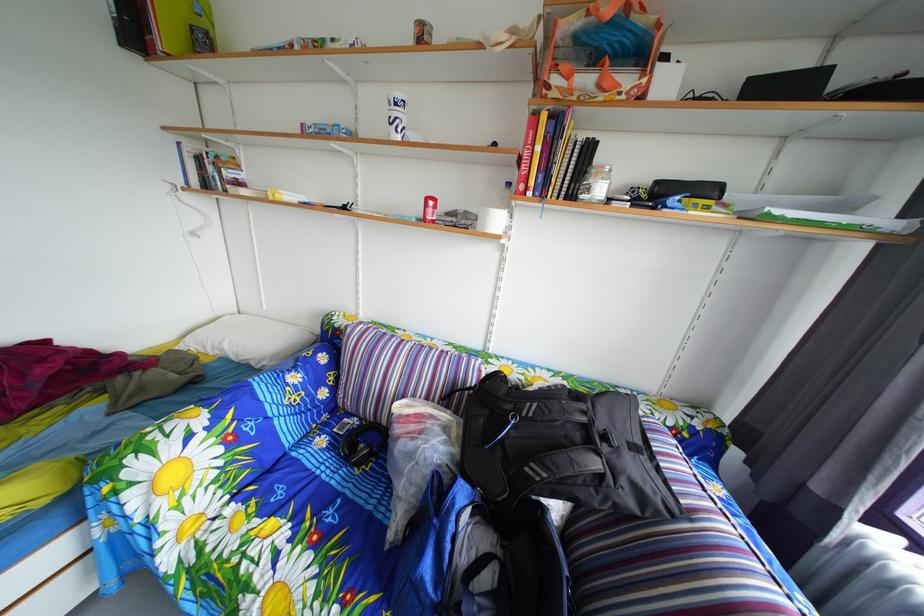
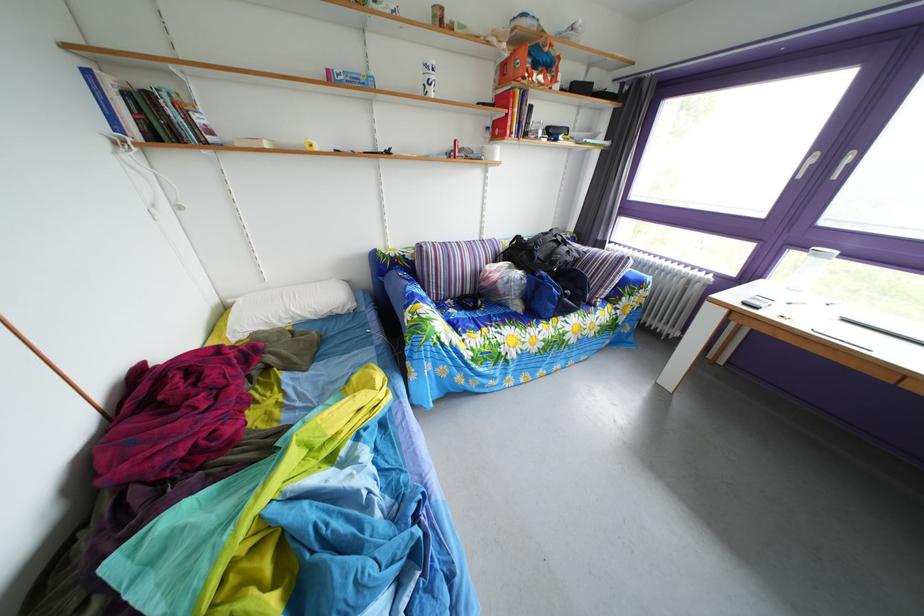
Where in the second image is the point corresponding to point 312,134 from the first image?

(339, 79)